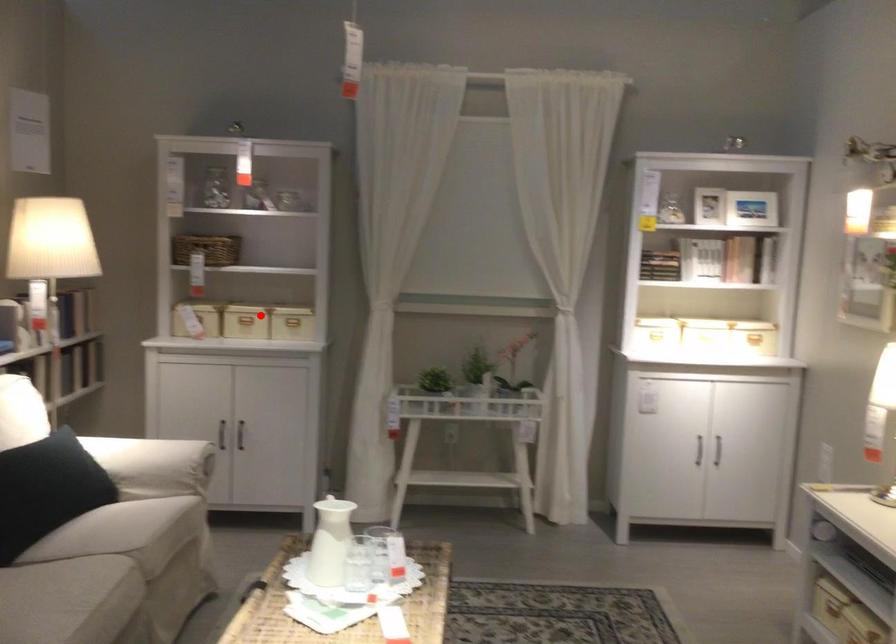
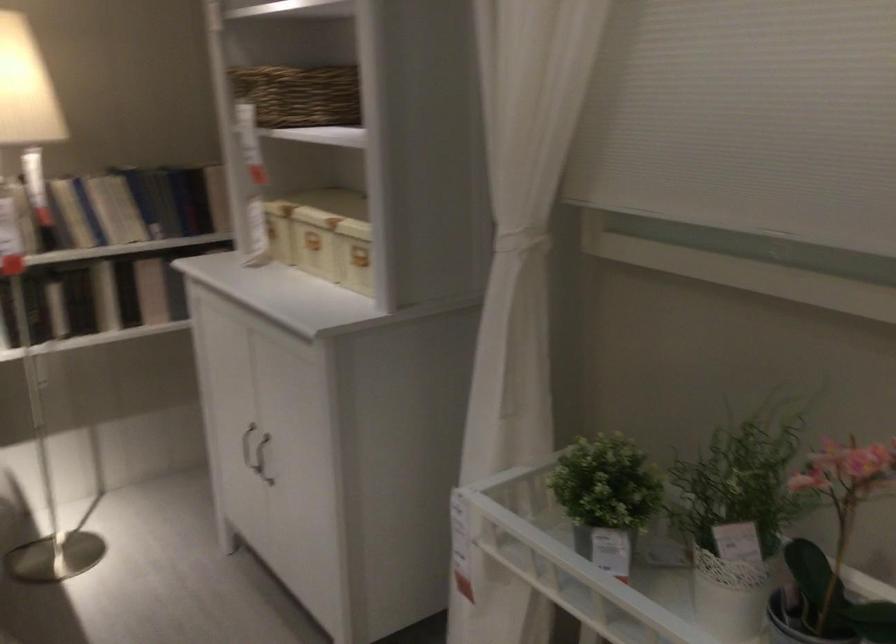
The point at the highlighted location is marked in the first image. Where is the corresponding point in the second image?

(314, 242)